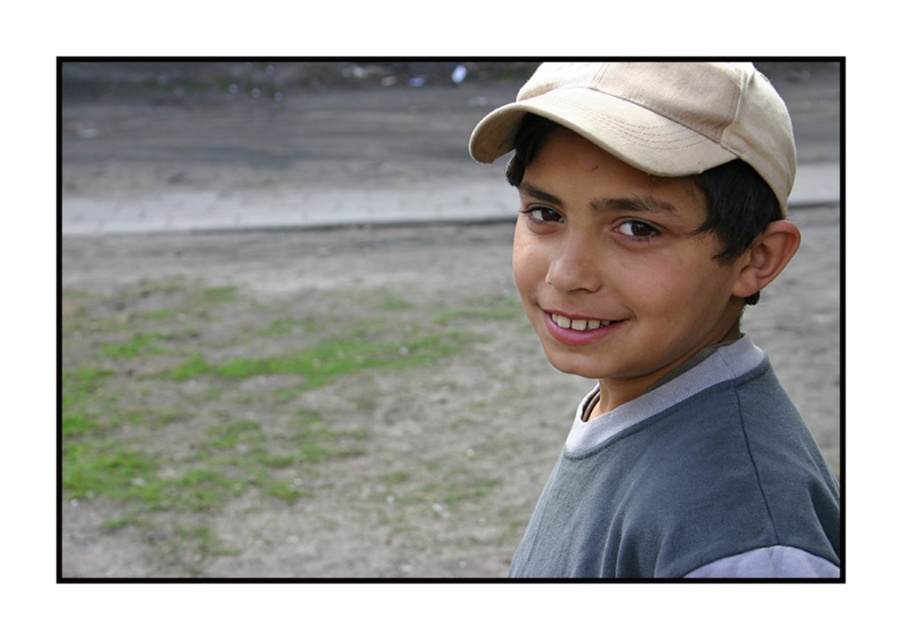
You are taking a photo of the matte gray shirt at center and the beige fabric baseball cap at upper right. Which object should you zoom in on to make them appear the same size in the photo?

To make the matte gray shirt at center and the beige fabric baseball cap at upper right appear the same size in the photo, you should zoom in on the beige fabric baseball cap at upper right since it is smaller than the matte gray shirt at center.

You are taking a photo of the boy in the scene. The camera is focused on his face. There is a point at coordinates point (725, 109) that you want to check. Is this point within the depth of field if the depth of field extends 4 feet from the camera?

The point at (725, 109) is 3.68 feet away from the camera, which is within the 4 feet depth of field range. Therefore, it should be in focus.

You are taking a photo of the boy and want to adjust your focus. Since the matte gray shirt at center and the beige fabric baseball cap at upper right are both in the frame, which object is positioned more to the right?

The matte gray shirt at center is positioned more to the right than the beige fabric baseball cap at upper right.